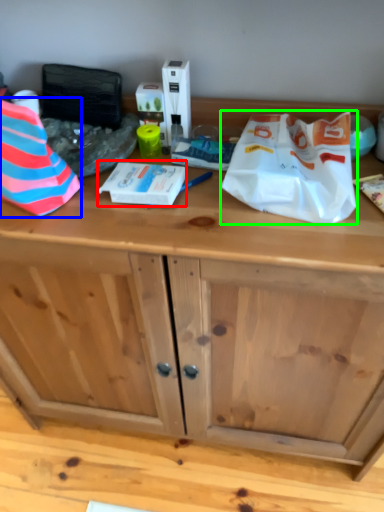
Question: Which is farther away from wrapping paper (highlighted by a red box)? wrapping paper (highlighted by a blue box) or wrapping paper (highlighted by a green box)?

Choices:
 (A) wrapping paper
 (B) wrapping paper

Answer: (B)